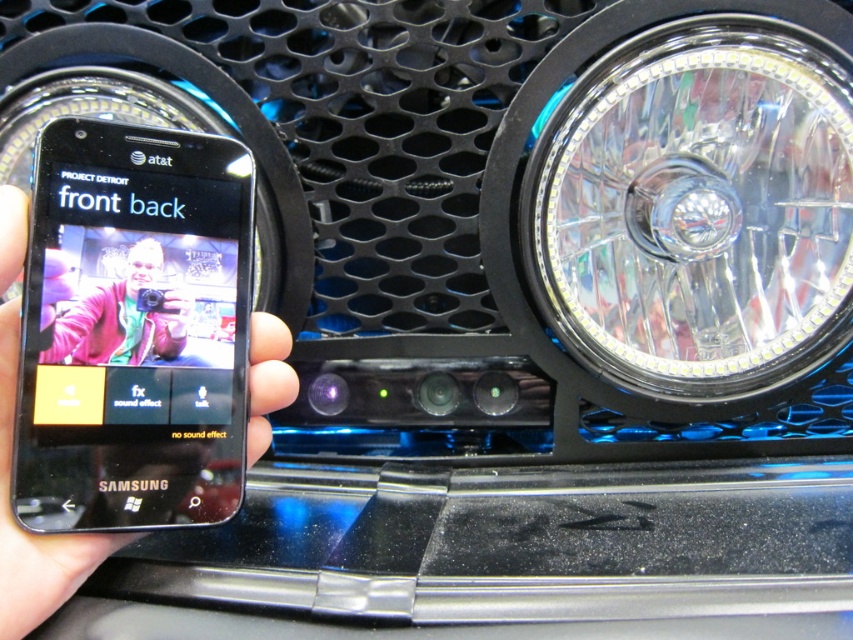
Can you confirm if clear glass headlight at right is taller than black matte phone at left?

Indeed, clear glass headlight at right has a greater height compared to black matte phone at left.

The height and width of the screenshot is (640, 853). What do you see at coordinates (697, 205) in the screenshot?
I see `clear glass headlight at right` at bounding box center [697, 205].

Image resolution: width=853 pixels, height=640 pixels. What do you see at coordinates (697, 205) in the screenshot? I see `clear glass headlight at right` at bounding box center [697, 205].

Locate an element on the screen. clear glass headlight at right is located at coordinates (697, 205).

Does clear glass headlight at right have a smaller size compared to matte pink jacket at center?

No.

Does point (544, 154) come closer to viewer compared to point (128, 336)?

No, it is behind (128, 336).

Locate an element on the screen. This screenshot has height=640, width=853. clear glass headlight at right is located at coordinates (697, 205).

Between black matte phone at left and matte pink jacket at center, which one appears on the right side from the viewer's perspective?

From the viewer's perspective, black matte phone at left appears more on the right side.

Is point (7, 516) positioned after point (167, 352)?

That is False.

Find the location of a particular element. black matte phone at left is located at coordinates (32, 532).